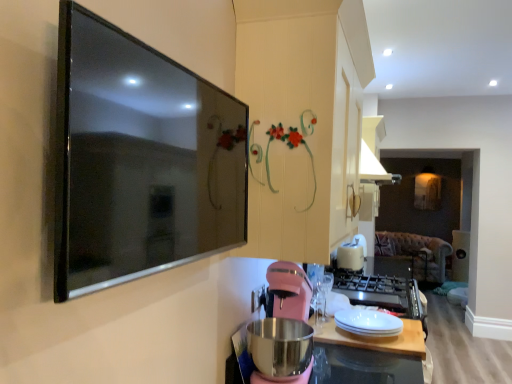
What is the approximate width of white plastic toaster at upper center?

It is 27.89 centimeters.

Describe the element at coordinates (370, 357) in the screenshot. I see `metallic stainless steel at lower center` at that location.

This screenshot has width=512, height=384. What do you see at coordinates (139, 160) in the screenshot?
I see `black glossy tv at upper left` at bounding box center [139, 160].

Where is `white plastic toaster at upper center`? The width and height of the screenshot is (512, 384). white plastic toaster at upper center is located at coordinates (352, 254).

From the image's perspective, is yellow matte cabinet at upper center located above white matte wood at center?

Yes, from the image's perspective, yellow matte cabinet at upper center is on top of white matte wood at center.

Is yellow matte cabinet at upper center taller or shorter than white matte wood at center?

In the image, yellow matte cabinet at upper center appears to be taller than white matte wood at center.

Does point (283, 55) come farther from viewer compared to point (420, 323)?

No, (283, 55) is closer to viewer.

Can you tell me how much white glossy plate at center and metallic stainless steel at lower center differ in facing direction?

The angle between the facing direction of white glossy plate at center and the facing direction of metallic stainless steel at lower center is 0.00223 degrees.

In the scene shown: Is white glossy plate at center beside metallic stainless steel at lower center?

Yes, white glossy plate at center is in contact with metallic stainless steel at lower center.

Where is `countertop that appears on the left of white glossy plate at center`? Image resolution: width=512 pixels, height=384 pixels. countertop that appears on the left of white glossy plate at center is located at coordinates (370, 357).

Is white glossy plate at center looking in the opposite direction of metallic stainless steel at lower center?

That's right, white glossy plate at center is facing away from metallic stainless steel at lower center.

Looking at this image, is yellow matte cabinet at upper center bigger than white glossy plate at center?

Yes.

Between yellow matte cabinet at upper center and white glossy plate at center, which one is positioned in front?

yellow matte cabinet at upper center is in front.

Which object is positioned more to the right, white matte wood at center or white plastic toaster at upper center?

white plastic toaster at upper center is more to the right.

Could you tell me if white matte wood at center is turned towards white plastic toaster at upper center?

No, white matte wood at center is not aimed at white plastic toaster at upper center.

Based on the photo, considering the sizes of objects white matte wood at center and white plastic toaster at upper center in the image provided, who is thinner, white matte wood at center or white plastic toaster at upper center?

With smaller width is white plastic toaster at upper center.

Is white matte wood at center shorter than white plastic toaster at upper center?

Yes.

Considering the positions of point (331, 349) and point (343, 244), is point (331, 349) closer or farther from the camera than point (343, 244)?

Point (331, 349).

Considering the sizes of objects metallic stainless steel at lower center and white plastic toaster at upper center in the image provided, who is bigger, metallic stainless steel at lower center or white plastic toaster at upper center?

With larger size is metallic stainless steel at lower center.

From a real-world perspective, which object stands above the other?

white plastic toaster at upper center is physically above.

Considering the relative sizes of black glossy tv at upper left and yellow matte cabinet at upper center in the image provided, is black glossy tv at upper left smaller than yellow matte cabinet at upper center?

Indeed, black glossy tv at upper left has a smaller size compared to yellow matte cabinet at upper center.

How many degrees apart are the facing directions of black glossy tv at upper left and yellow matte cabinet at upper center?

The facing directions of black glossy tv at upper left and yellow matte cabinet at upper center are 0.00347 degrees apart.

From the image's perspective, between black glossy tv at upper left and yellow matte cabinet at upper center, who is located below?

black glossy tv at upper left is shown below in the image.

Is yellow matte cabinet at upper center to the left of black glossy tv at upper left from the viewer's perspective?

In fact, yellow matte cabinet at upper center is to the right of black glossy tv at upper left.

Is yellow matte cabinet at upper center situated inside black glossy tv at upper left or outside?

yellow matte cabinet at upper center lies outside black glossy tv at upper left.

Is yellow matte cabinet at upper center facing towards black glossy tv at upper left?

No, yellow matte cabinet at upper center is not facing towards black glossy tv at upper left.

Is yellow matte cabinet at upper center not near black glossy tv at upper left?

No.

Identify the location of cabinetry on the left of the white matte wood at center. (304, 119).

This screenshot has width=512, height=384. I want to click on platter above the metallic stainless steel at lower center (from the image's perspective), so click(368, 323).

Which object lies nearer to the anchor point white matte wood at center, yellow matte cabinet at upper center or white glossy plate at center?

Among the two, white glossy plate at center is located nearer to white matte wood at center.

Which object lies nearer to the anchor point black glossy tv at upper left, pink matte blender at lower center or white matte wood at center?

Based on the image, pink matte blender at lower center appears to be nearer to black glossy tv at upper left.

From the picture: When comparing their distances from black glossy tv at upper left, does pink matte blender at lower center or white plastic toaster at upper center seem further?

Among the two, white plastic toaster at upper center is located further to black glossy tv at upper left.

Which object lies further to the anchor point yellow matte cabinet at upper center, pink matte blender at lower center or metallic stainless steel at lower center?

metallic stainless steel at lower center lies further to yellow matte cabinet at upper center than the other object.

Based on their spatial positions, is pink matte blender at lower center or yellow matte cabinet at upper center closer to white glossy plate at center?

The object closer to white glossy plate at center is pink matte blender at lower center.

Based on their spatial positions, is metallic stainless steel at lower center or white matte wood at center further from white glossy plate at center?

metallic stainless steel at lower center is positioned further to the anchor white glossy plate at center.

Estimate the real-world distances between objects in this image. Which object is closer to black glossy tv at upper left, white glossy plate at center or white matte wood at center?

Based on the image, white glossy plate at center appears to be nearer to black glossy tv at upper left.

Which object lies nearer to the anchor point white matte wood at center, pink matte blender at lower center or metallic stainless steel at lower center?

metallic stainless steel at lower center lies closer to white matte wood at center than the other object.

In order to click on platter between yellow matte cabinet at upper center and metallic stainless steel at lower center in the vertical direction in this screenshot , I will do `click(368, 323)`.

Identify the location of cabinetry between black glossy tv at upper left and white matte wood at center in the front-back direction. (304, 119).

Where is `counter top positioned between yellow matte cabinet at upper center and white plastic toaster at upper center from near to far`? counter top positioned between yellow matte cabinet at upper center and white plastic toaster at upper center from near to far is located at coordinates (379, 339).

You are a GUI agent. You are given a task and a screenshot of the screen. Output one action in this format:
    pyautogui.click(x=<x>, y=<y>)
    Task: Click on the counter top positioned between metallic stainless steel at lower center and white plastic toaster at upper center from near to far
    The image size is (512, 384).
    Given the screenshot: What is the action you would take?
    point(379,339)